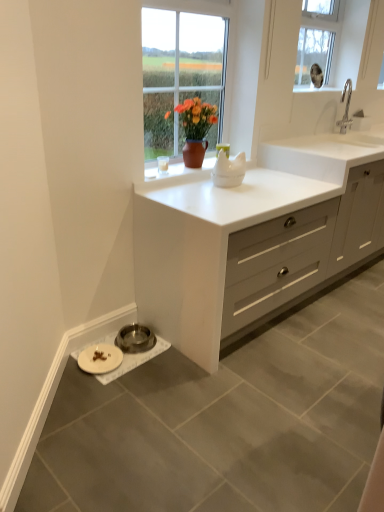
This screenshot has width=384, height=512. Describe the element at coordinates (349, 111) in the screenshot. I see `white ceramic sink at upper right` at that location.

In order to click on white ceramic sink at upper right in this screenshot , I will do `click(349, 111)`.

Locate an element on the screen. The height and width of the screenshot is (512, 384). white matte plate at lower left is located at coordinates (100, 358).

The image size is (384, 512). What do you see at coordinates (248, 248) in the screenshot? I see `white matte cabinet at center` at bounding box center [248, 248].

Describe the element at coordinates (229, 170) in the screenshot. This screenshot has width=384, height=512. I see `white glossy cat-shaped object at center, marked as the second appliance in a left-to-right arrangement` at that location.

Measure the distance between metallic stainless steel bowl at lower left, which ranks as the 1th appliance in left-to-right order, and camera.

metallic stainless steel bowl at lower left, which ranks as the 1th appliance in left-to-right order, is 2.18 meters from camera.

Identify the location of white ceramic sink at upper right. This screenshot has height=512, width=384. (349, 111).

Considering the positions of point (139, 330) and point (136, 247), is point (139, 330) closer or farther from the camera than point (136, 247)?

Point (139, 330) appears to be farther away from the viewer than point (136, 247).

From the image's perspective, is metallic stainless steel bowl at lower left, the second appliance from the right, above or below white matte cabinet at center?

metallic stainless steel bowl at lower left, the second appliance from the right, is situated lower than white matte cabinet at center in the image.

Locate an element on the screen. appliance below the white matte cabinet at center (from a real-world perspective) is located at coordinates (135, 338).

Measure the distance from metallic stainless steel bowl at lower left, which ranks as the 1th appliance in left-to-right order, to white matte cabinet at center.

They are 29.13 inches apart.

In the scene shown: Can you confirm if white glossy cat-shaped object at center, which ranks as the first appliance in top-to-bottom order, is smaller than white matte plate at lower left?

Actually, white glossy cat-shaped object at center, which ranks as the first appliance in top-to-bottom order, might be larger than white matte plate at lower left.

From a real-world perspective, which is physically above, white glossy cat-shaped object at center, the second appliance ordered from the bottom, or white matte plate at lower left?

white glossy cat-shaped object at center, the second appliance ordered from the bottom.

Identify the location of sink above the white matte cabinet at center (from a real-world perspective). (349, 111).

How different are the orientations of white matte cabinet at center and white ceramic sink at upper right in degrees?

2.68 degrees separate the facing orientations of white matte cabinet at center and white ceramic sink at upper right.

Can you confirm if white matte cabinet at center is bigger than white ceramic sink at upper right?

Yes, white matte cabinet at center is bigger than white ceramic sink at upper right.

Would you say white matte cabinet at center is a long distance from white ceramic sink at upper right?

Yes, white matte cabinet at center is far from white ceramic sink at upper right.

Based on their sizes in the image, would you say white matte cabinet at center is bigger or smaller than clear glass window at upper center?

In the image, white matte cabinet at center appears to be larger than clear glass window at upper center.

Which object is wider, white matte cabinet at center or clear glass window at upper center?

white matte cabinet at center is wider.

Is white matte cabinet at center taller or shorter than clear glass window at upper center?

Clearly, white matte cabinet at center is taller compared to clear glass window at upper center.

Is white ceramic sink at upper right at the back of metallic stainless steel bowl at lower left, which is counted as the second appliance, starting from the top?

No, metallic stainless steel bowl at lower left, which is counted as the second appliance, starting from the top, is not facing away from white ceramic sink at upper right.

In terms of height, does metallic stainless steel bowl at lower left, the first appliance positioned from the bottom, look taller or shorter compared to white ceramic sink at upper right?

metallic stainless steel bowl at lower left, the first appliance positioned from the bottom, is shorter than white ceramic sink at upper right.

Between metallic stainless steel bowl at lower left, which is counted as the second appliance, starting from the top, and white ceramic sink at upper right, which one has smaller width?

With smaller width is white ceramic sink at upper right.

From the image's perspective, is metallic stainless steel bowl at lower left, the first appliance positioned from the bottom, above or below white ceramic sink at upper right?

Clearly, from the image's perspective, metallic stainless steel bowl at lower left, the first appliance positioned from the bottom, is below white ceramic sink at upper right.

Considering the relative positions of white glossy cat-shaped object at center, the second appliance ordered from the bottom, and metallic stainless steel bowl at lower left, which ranks as the 1th appliance in left-to-right order, in the image provided, is white glossy cat-shaped object at center, the second appliance ordered from the bottom, to the right of metallic stainless steel bowl at lower left, which ranks as the 1th appliance in left-to-right order, from the viewer's perspective?

Correct, you'll find white glossy cat-shaped object at center, the second appliance ordered from the bottom, to the right of metallic stainless steel bowl at lower left, which ranks as the 1th appliance in left-to-right order.

Considering the positions of objects white glossy cat-shaped object at center, which is the first appliance in right-to-left order, and metallic stainless steel bowl at lower left, the first appliance positioned from the bottom, in the image provided, who is in front, white glossy cat-shaped object at center, which is the first appliance in right-to-left order, or metallic stainless steel bowl at lower left, the first appliance positioned from the bottom,?

white glossy cat-shaped object at center, which is the first appliance in right-to-left order, is closer to the camera.

Is white glossy cat-shaped object at center, which ranks as the first appliance in top-to-bottom order, taller than metallic stainless steel bowl at lower left, the second appliance from the right?

Yes.

Where is `appliance in front of the metallic stainless steel bowl at lower left, which is counted as the second appliance, starting from the top`? appliance in front of the metallic stainless steel bowl at lower left, which is counted as the second appliance, starting from the top is located at coordinates (229, 170).

Consider the image. How far apart are white matte cabinet at center and white matte plate at lower left?

87.72 centimeters.

Could you tell me if white matte cabinet at center is facing white matte plate at lower left?

No, white matte cabinet at center is not turned towards white matte plate at lower left.

From a real-world perspective, between white matte cabinet at center and white matte plate at lower left, who is vertically lower?

white matte plate at lower left, from a real-world perspective.

Considering the points (314, 284) and (91, 367), which point is behind, point (314, 284) or point (91, 367)?

Positioned behind is point (314, 284).

You are a GUI agent. You are given a task and a screenshot of the screen. Output one action in this format:
    pyautogui.click(x=<x>, y=<y>)
    Task: Click on the appliance that is under the white matte cabinet at center (from a real-world perspective)
    Image resolution: width=384 pixels, height=512 pixels.
    Given the screenshot: What is the action you would take?
    pyautogui.click(x=135, y=338)

Where is `appliance above the white matte plate at lower left (from a real-world perspective)`? Image resolution: width=384 pixels, height=512 pixels. appliance above the white matte plate at lower left (from a real-world perspective) is located at coordinates (229, 170).

Based on their spatial positions, is white matte plate at lower left or white ceramic sink at upper right closer to white glossy cat-shaped object at center, the second appliance ordered from the bottom?

white matte plate at lower left is positioned closer to the anchor white glossy cat-shaped object at center, the second appliance ordered from the bottom.

Looking at the image, which one is located further to white matte plate at lower left, clear glass window at upper center or white matte cabinet at center?

The object further to white matte plate at lower left is clear glass window at upper center.

When comparing their distances from white matte plate at lower left, does white glossy cat-shaped object at center, which ranks as the first appliance in top-to-bottom order, or clear glass window at upper center seem closer?

Among the two, white glossy cat-shaped object at center, which ranks as the first appliance in top-to-bottom order, is located nearer to white matte plate at lower left.

Based on their spatial positions, is white matte cabinet at center or white glossy cat-shaped object at center, which ranks as the first appliance in top-to-bottom order, closer to clear glass window at upper center?

white matte cabinet at center is positioned closer to the anchor clear glass window at upper center.

From the image, which object appears to be nearer to clear glass window at upper center, white matte plate at lower left or metallic stainless steel bowl at lower left, which ranks as the 1th appliance in left-to-right order?

The object closer to clear glass window at upper center is metallic stainless steel bowl at lower left, which ranks as the 1th appliance in left-to-right order.

Looking at the image, which one is located closer to white matte cabinet at center, clear glass window at upper center or white glossy cat-shaped object at center, marked as the second appliance in a left-to-right arrangement?

white glossy cat-shaped object at center, marked as the second appliance in a left-to-right arrangement, lies closer to white matte cabinet at center than the other object.

When comparing their distances from white ceramic sink at upper right, does metallic stainless steel bowl at lower left, the second appliance from the right, or white glossy cat-shaped object at center, which is the first appliance in right-to-left order, seem further?

metallic stainless steel bowl at lower left, the second appliance from the right, lies further to white ceramic sink at upper right than the other object.

Looking at the image, which one is located closer to metallic stainless steel bowl at lower left, the first appliance positioned from the bottom, clear glass window at upper center or white glossy cat-shaped object at center, marked as the second appliance in a left-to-right arrangement?

The object closer to metallic stainless steel bowl at lower left, the first appliance positioned from the bottom, is white glossy cat-shaped object at center, marked as the second appliance in a left-to-right arrangement.

Locate an element on the screen. This screenshot has height=512, width=384. sink between clear glass window at upper center and white matte plate at lower left in the up-down direction is located at coordinates (349, 111).

You are a GUI agent. You are given a task and a screenshot of the screen. Output one action in this format:
    pyautogui.click(x=<x>, y=<y>)
    Task: Click on the cabinetry between white ceramic sink at upper right and white matte plate at lower left in the up-down direction
    Image resolution: width=384 pixels, height=512 pixels.
    Given the screenshot: What is the action you would take?
    pyautogui.click(x=248, y=248)

At what (x,y) coordinates should I click in order to perform the action: click on appliance between clear glass window at upper center and metallic stainless steel bowl at lower left, which is counted as the second appliance, starting from the top, in the up-down direction. Please return your answer as a coordinate pair (x, y). The width and height of the screenshot is (384, 512). Looking at the image, I should click on (229, 170).

This screenshot has height=512, width=384. What are the coordinates of `cabinetry between clear glass window at upper center and white matte plate at lower left in the vertical direction` in the screenshot? It's located at (248, 248).